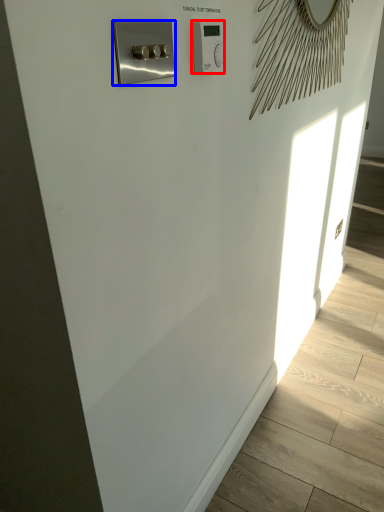
Question: Among these objects, which one is nearest to the camera, light switch (highlighted by a red box) or switch (highlighted by a blue box)?

Choices:
 (A) light switch
 (B) switch

Answer: (B)